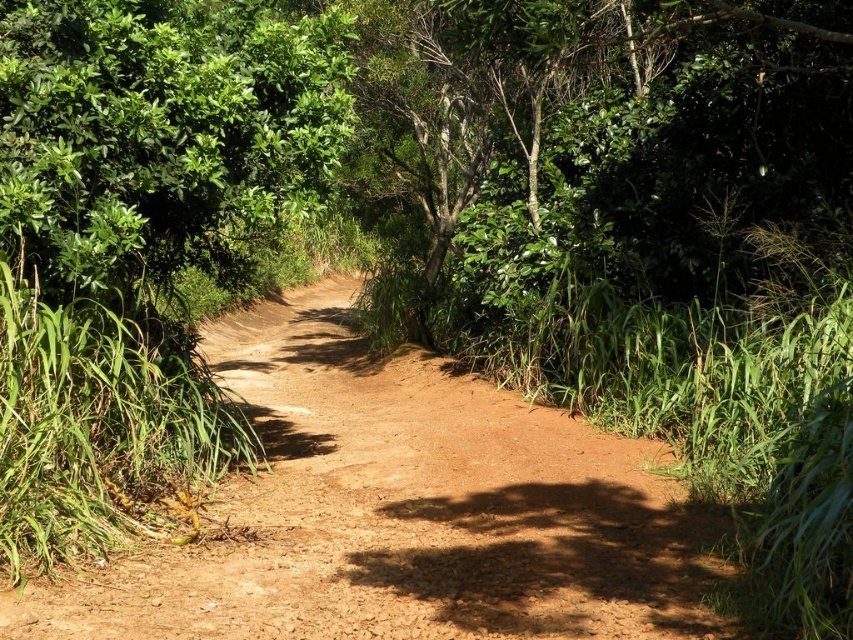
Which is more to the right, dusty brown dirt track at center or green leafy tree at upper left?

dusty brown dirt track at center is more to the right.

Which is in front, point (309, 324) or point (13, 54)?

Point (13, 54) is more forward.

The height and width of the screenshot is (640, 853). Find the location of `dusty brown dirt track at center`. dusty brown dirt track at center is located at coordinates (401, 513).